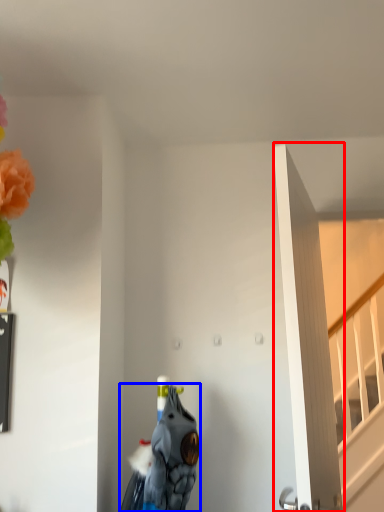
Question: Which object is closer to the camera taking this photo, door (highlighted by a red box) or animal (highlighted by a blue box)?

Choices:
 (A) door
 (B) animal

Answer: (A)